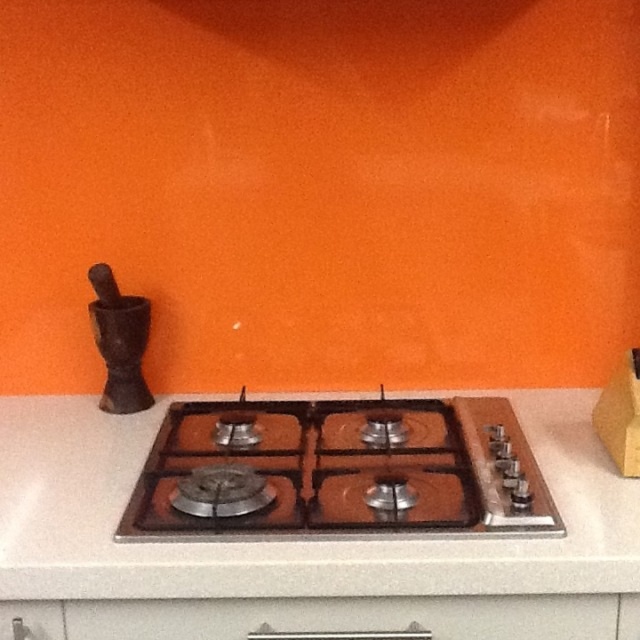
Question: Does satin silver gas stove at center have a greater width compared to white matte drawer at center?

Choices:
 (A) no
 (B) yes

Answer: (A)

Question: Considering the real-world distances, which object is closest to the white matte drawer at center?

Choices:
 (A) satin silver gas stove at center
 (B) brushed metal drawer at lower left

Answer: (A)

Question: Is white matte drawer at center below brushed metal drawer at lower left?

Choices:
 (A) no
 (B) yes

Answer: (A)

Question: Among these objects, which one is nearest to the camera?

Choices:
 (A) brushed metal drawer at lower left
 (B) white matte drawer at center

Answer: (B)

Question: Can you confirm if white matte drawer at center is positioned below brushed metal drawer at lower left?

Choices:
 (A) no
 (B) yes

Answer: (A)

Question: Which object is farther from the camera taking this photo?

Choices:
 (A) brushed metal drawer at lower left
 (B) satin silver gas stove at center
 (C) white matte drawer at center

Answer: (B)